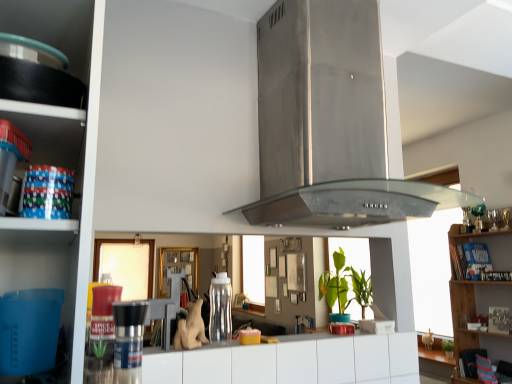
Question: Is the surface of wooden bookshelf at right, which is the third shelf in left-to-right order, in direct contact with clear plastic water bottle at center, acting as the 2th appliance starting from the front?

Choices:
 (A) no
 (B) yes

Answer: (A)

Question: Does wooden bookshelf at right, arranged as the 3th shelf when viewed from the front, have a lesser height compared to clear plastic water bottle at center, acting as the 2th appliance starting from the front?

Choices:
 (A) yes
 (B) no

Answer: (B)

Question: Is wooden bookshelf at right, arranged as the 3th shelf when viewed from the front, wider than clear plastic water bottle at center, placed as the 2th appliance when sorted from left to right?

Choices:
 (A) no
 (B) yes

Answer: (B)

Question: Considering the relative positions of wooden bookshelf at right, arranged as the 3th shelf when viewed from the front, and clear plastic water bottle at center, acting as the 2th appliance starting from the front, in the image provided, is wooden bookshelf at right, arranged as the 3th shelf when viewed from the front, to the left of clear plastic water bottle at center, acting as the 2th appliance starting from the front, from the viewer's perspective?

Choices:
 (A) yes
 (B) no

Answer: (B)

Question: From the image's perspective, is wooden bookshelf at right, marked as the 3th shelf in a top-to-bottom arrangement, above clear plastic water bottle at center, the 1th appliance from the back?

Choices:
 (A) yes
 (B) no

Answer: (B)

Question: Could you tell me if wooden bookshelf at right, acting as the 1th shelf starting from the right, is facing clear plastic water bottle at center, acting as the 2th appliance starting from the front?

Choices:
 (A) no
 (B) yes

Answer: (B)

Question: From a real-world perspective, is brushed metal pepper grinder at center, which is the second appliance in right-to-left order, located higher than white matte drawer at center?

Choices:
 (A) yes
 (B) no

Answer: (A)

Question: Does brushed metal pepper grinder at center, acting as the second appliance starting from the back, turn towards white matte drawer at center?

Choices:
 (A) no
 (B) yes

Answer: (A)

Question: Is brushed metal pepper grinder at center, acting as the first appliance starting from the front, next to white matte drawer at center and touching it?

Choices:
 (A) yes
 (B) no

Answer: (B)

Question: Does brushed metal pepper grinder at center, which is the second appliance in right-to-left order, have a greater height compared to white matte drawer at center?

Choices:
 (A) yes
 (B) no

Answer: (B)

Question: From a real-world perspective, is brushed metal pepper grinder at center, acting as the first appliance starting from the front, under white matte drawer at center?

Choices:
 (A) no
 (B) yes

Answer: (A)

Question: From the image's perspective, is brushed metal pepper grinder at center, acting as the first appliance starting from the front, below white matte drawer at center?

Choices:
 (A) no
 (B) yes

Answer: (A)

Question: Does brushed metal pepper grinder at center, the first appliance positioned from the left, have a smaller size compared to matte black pan at left, which ranks as the 1th shelf in top-to-bottom order?

Choices:
 (A) no
 (B) yes

Answer: (B)